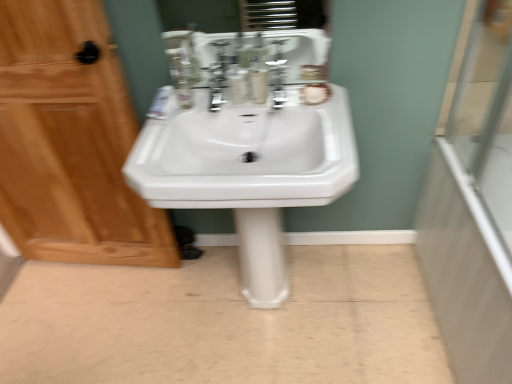
Locate an element on the screen. vacant space to the right of satin nickel faucet at upper center is located at coordinates (330, 104).